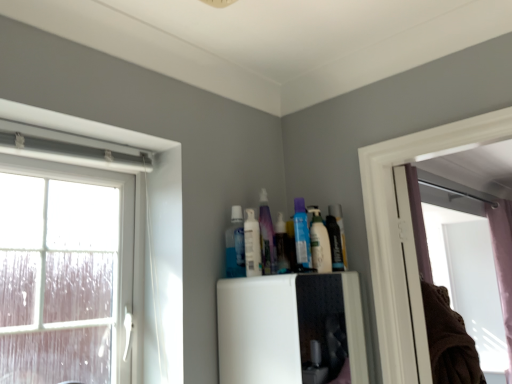
In order to face translucent plastic bottle at upper center, arranged as the fourth toiletry when viewed from the left, should I rotate leftwards or rightwards?

You should look right and rotate roughly 3.434 degrees.

The image size is (512, 384). What do you see at coordinates (136, 228) in the screenshot? I see `clear glass window at left` at bounding box center [136, 228].

In order to face white glossy lotion at upper center, positioned as the second toiletry in left-to-right order, should I rotate leftwards or rightwards?

You should look left and rotate roughly 0.385 degrees.

Measure the distance between point (x=435, y=366) and camera.

A distance of 1.42 meters exists between point (x=435, y=366) and camera.

Identify the location of translucent purple bottle at upper center, which is the third toiletry in left-to-right order. This screenshot has width=512, height=384. (266, 236).

Identify the location of translucent plastic bottle at upper center, marked as the 2th toiletry in a right-to-left arrangement. (282, 246).

Consider the image. Is white glossy lotion at upper center, which ranks as the fourth toiletry in right-to-left order, positioned with its back to clear glass window at left?

No, clear glass window at left is not at the back of white glossy lotion at upper center, which ranks as the fourth toiletry in right-to-left order.

Which object is closer to the camera taking this photo, white glossy lotion at upper center, positioned as the second toiletry in left-to-right order, or clear glass window at left?

clear glass window at left is closer to the camera.

From the image's perspective, would you say white glossy lotion at upper center, positioned as the second toiletry in left-to-right order, is positioned over clear glass window at left?

Yes, from the image's perspective, white glossy lotion at upper center, positioned as the second toiletry in left-to-right order, is above clear glass window at left.

Do you think translucent plastic bottle at upper center, marked as the 2th toiletry in a right-to-left arrangement, is within clear glass window at left, or outside of it?

translucent plastic bottle at upper center, marked as the 2th toiletry in a right-to-left arrangement, cannot be found inside clear glass window at left.

Considering the sizes of objects translucent plastic bottle at upper center, arranged as the fourth toiletry when viewed from the left, and clear glass window at left in the image provided, who is smaller, translucent plastic bottle at upper center, arranged as the fourth toiletry when viewed from the left, or clear glass window at left?

translucent plastic bottle at upper center, arranged as the fourth toiletry when viewed from the left, is smaller.

Is translucent plastic bottle at upper center, arranged as the fourth toiletry when viewed from the left, positioned far away from clear glass window at left?

No, translucent plastic bottle at upper center, arranged as the fourth toiletry when viewed from the left, is not far away from clear glass window at left.

Considering the sizes of objects translucent plastic bottle at upper center, arranged as the fourth toiletry when viewed from the left, and clear glass window at left in the image provided, who is wider, translucent plastic bottle at upper center, arranged as the fourth toiletry when viewed from the left, or clear glass window at left?

translucent plastic bottle at upper center, arranged as the fourth toiletry when viewed from the left, is wider.

Is the surface of brown cotton laundry at right in direct contact with translucent plastic bottle at upper center, marked as the 2th toiletry in a right-to-left arrangement?

brown cotton laundry at right is not next to translucent plastic bottle at upper center, marked as the 2th toiletry in a right-to-left arrangement, and they're not touching.

Which object is positioned more to the right, brown cotton laundry at right or translucent plastic bottle at upper center, marked as the 2th toiletry in a right-to-left arrangement?

brown cotton laundry at right.

I want to click on laundry on the right of the translucent plastic bottle at upper center, marked as the 2th toiletry in a right-to-left arrangement, so (x=448, y=340).

Which is less distant, (468, 344) or (278, 248)?

The point (278, 248) is closer.

Based on their sizes in the image, would you say translucent plastic bottle at upper center, arranged as the fourth toiletry when viewed from the left, is bigger or smaller than translucent plastic spray bottle at upper center, which is the fifth toiletry in left-to-right order?

Considering their sizes, translucent plastic bottle at upper center, arranged as the fourth toiletry when viewed from the left, takes up less space than translucent plastic spray bottle at upper center, which is the fifth toiletry in left-to-right order.

Would you say translucent plastic spray bottle at upper center, which is the 1th toiletry from right to left, is part of translucent plastic bottle at upper center, marked as the 2th toiletry in a right-to-left arrangement,'s contents?

Actually, translucent plastic spray bottle at upper center, which is the 1th toiletry from right to left, is outside translucent plastic bottle at upper center, marked as the 2th toiletry in a right-to-left arrangement.

From a real-world perspective, count 3rd toiletrys downward from the translucent plastic bottle at upper center, arranged as the fourth toiletry when viewed from the left, and point to it. Please provide its 2D coordinates.

[(319, 243)]

In the scene shown: Who is shorter, translucent plastic bottle at upper center, marked as the 2th toiletry in a right-to-left arrangement, or translucent plastic spray bottle at upper center, which is the fifth toiletry in left-to-right order?

Standing shorter between the two is translucent plastic spray bottle at upper center, which is the fifth toiletry in left-to-right order.

Based on the photo, does translucent plastic spray bottle at upper center, which is the fifth toiletry in left-to-right order, turn towards translucent plastic toothpaste at upper center, the fifth toiletry positioned from the right?

No, translucent plastic spray bottle at upper center, which is the fifth toiletry in left-to-right order, is not oriented towards translucent plastic toothpaste at upper center, the fifth toiletry positioned from the right.

Can you confirm if translucent plastic spray bottle at upper center, which is the 1th toiletry from right to left, is smaller than translucent plastic toothpaste at upper center, the fifth toiletry positioned from the right?

No.

Looking at this image, how different are the orientations of translucent plastic spray bottle at upper center, which is the 1th toiletry from right to left, and translucent plastic toothpaste at upper center, the fifth toiletry positioned from the right, in degrees?

There is a 0.00104-degree angle between the facing directions of translucent plastic spray bottle at upper center, which is the 1th toiletry from right to left, and translucent plastic toothpaste at upper center, the fifth toiletry positioned from the right.

From the image's perspective, is translucent plastic spray bottle at upper center, which is the 1th toiletry from right to left, on top of translucent plastic toothpaste at upper center, the 1th toiletry from the left?

Yes, from the image's perspective, translucent plastic spray bottle at upper center, which is the 1th toiletry from right to left, is above translucent plastic toothpaste at upper center, the 1th toiletry from the left.

Can you confirm if translucent plastic bottle at upper center, arranged as the fourth toiletry when viewed from the left, is bigger than translucent plastic toothpaste at upper center, the 1th toiletry from the left?

Incorrect, translucent plastic bottle at upper center, arranged as the fourth toiletry when viewed from the left, is not larger than translucent plastic toothpaste at upper center, the 1th toiletry from the left.

Which toiletry is the 2nd one when counting from the front of the translucent plastic bottle at upper center, arranged as the fourth toiletry when viewed from the left? Please provide its 2D coordinates.

[(234, 245)]

From a real-world perspective, between translucent plastic bottle at upper center, marked as the 2th toiletry in a right-to-left arrangement, and translucent plastic toothpaste at upper center, the fifth toiletry positioned from the right, who is vertically higher?

translucent plastic bottle at upper center, marked as the 2th toiletry in a right-to-left arrangement.

Which of these two, translucent plastic bottle at upper center, arranged as the fourth toiletry when viewed from the left, or translucent plastic toothpaste at upper center, the fifth toiletry positioned from the right, is thinner?

translucent plastic bottle at upper center, arranged as the fourth toiletry when viewed from the left, is thinner.

Which of these two, clear glass window at left or white glossy lotion at upper center, positioned as the second toiletry in left-to-right order, is wider?

white glossy lotion at upper center, positioned as the second toiletry in left-to-right order.

In terms of height, does clear glass window at left look taller or shorter compared to white glossy lotion at upper center, positioned as the second toiletry in left-to-right order?

Clearly, clear glass window at left is taller compared to white glossy lotion at upper center, positioned as the second toiletry in left-to-right order.

Measure the distance between clear glass window at left and white glossy lotion at upper center, positioned as the second toiletry in left-to-right order.

clear glass window at left is 13.20 inches away from white glossy lotion at upper center, positioned as the second toiletry in left-to-right order.

From a real-world perspective, which is physically above, clear glass window at left or white glossy lotion at upper center, positioned as the second toiletry in left-to-right order?

From a 3D spatial view, white glossy lotion at upper center, positioned as the second toiletry in left-to-right order, is above.

Identify the location of window below the white glossy lotion at upper center, positioned as the second toiletry in left-to-right order (from the image's perspective). (136, 228).

In order to click on the 4th toiletry above the clear glass window at left (from a real-world perspective) in this screenshot , I will do `click(282, 246)`.

Which object lies further to the anchor point translucent plastic spray bottle at upper center, which is the fifth toiletry in left-to-right order, brown cotton laundry at right or clear glass window at left?

brown cotton laundry at right is positioned further to the anchor translucent plastic spray bottle at upper center, which is the fifth toiletry in left-to-right order.

Looking at this image, considering their positions, is translucent plastic toothpaste at upper center, the 1th toiletry from the left, positioned further to translucent plastic bottle at upper center, arranged as the fourth toiletry when viewed from the left, than clear glass window at left?

Among the two, clear glass window at left is located further to translucent plastic bottle at upper center, arranged as the fourth toiletry when viewed from the left.

From the picture: Looking at the image, which one is located further to translucent plastic spray bottle at upper center, which is the 1th toiletry from right to left, translucent plastic bottle at upper center, marked as the 2th toiletry in a right-to-left arrangement, or translucent plastic toothpaste at upper center, the fifth toiletry positioned from the right?

Among the two, translucent plastic toothpaste at upper center, the fifth toiletry positioned from the right, is located further to translucent plastic spray bottle at upper center, which is the 1th toiletry from right to left.

From the image, which object appears to be nearer to translucent purple bottle at upper center, which is the third toiletry in left-to-right order, brown cotton laundry at right or clear glass window at left?

Among the two, clear glass window at left is located nearer to translucent purple bottle at upper center, which is the third toiletry in left-to-right order.

From the image, which object appears to be nearer to white glossy lotion at upper center, positioned as the second toiletry in left-to-right order, brown cotton laundry at right or translucent plastic toothpaste at upper center, the fifth toiletry positioned from the right?

Based on the image, translucent plastic toothpaste at upper center, the fifth toiletry positioned from the right, appears to be nearer to white glossy lotion at upper center, positioned as the second toiletry in left-to-right order.

When comparing their distances from translucent plastic toothpaste at upper center, the fifth toiletry positioned from the right, does clear glass window at left or brown cotton laundry at right seem closer?

clear glass window at left.

Based on their spatial positions, is translucent purple bottle at upper center, acting as the 3th toiletry starting from the right, or clear glass window at left further from brown cotton laundry at right?

clear glass window at left is positioned further to the anchor brown cotton laundry at right.

In the scene shown: Looking at the image, which one is located further to translucent purple bottle at upper center, which is the third toiletry in left-to-right order, white glossy lotion at upper center, positioned as the second toiletry in left-to-right order, or translucent plastic toothpaste at upper center, the 1th toiletry from the left?

translucent plastic toothpaste at upper center, the 1th toiletry from the left, is further to translucent purple bottle at upper center, which is the third toiletry in left-to-right order.

Where is `toiletry located between translucent plastic bottle at upper center, arranged as the fourth toiletry when viewed from the left, and brown cotton laundry at right in the left-right direction`? toiletry located between translucent plastic bottle at upper center, arranged as the fourth toiletry when viewed from the left, and brown cotton laundry at right in the left-right direction is located at coordinates (319, 243).

Where is `toiletry located between translucent purple bottle at upper center, which is the third toiletry in left-to-right order, and translucent plastic spray bottle at upper center, which is the 1th toiletry from right to left, in the left-right direction`? toiletry located between translucent purple bottle at upper center, which is the third toiletry in left-to-right order, and translucent plastic spray bottle at upper center, which is the 1th toiletry from right to left, in the left-right direction is located at coordinates (282, 246).

The width and height of the screenshot is (512, 384). Find the location of `toiletry situated between translucent plastic toothpaste at upper center, the 1th toiletry from the left, and translucent purple bottle at upper center, acting as the 3th toiletry starting from the right, from left to right`. toiletry situated between translucent plastic toothpaste at upper center, the 1th toiletry from the left, and translucent purple bottle at upper center, acting as the 3th toiletry starting from the right, from left to right is located at coordinates (252, 244).

Image resolution: width=512 pixels, height=384 pixels. Find the location of `toiletry situated between clear glass window at left and white glossy lotion at upper center, positioned as the second toiletry in left-to-right order, from left to right`. toiletry situated between clear glass window at left and white glossy lotion at upper center, positioned as the second toiletry in left-to-right order, from left to right is located at coordinates (234, 245).